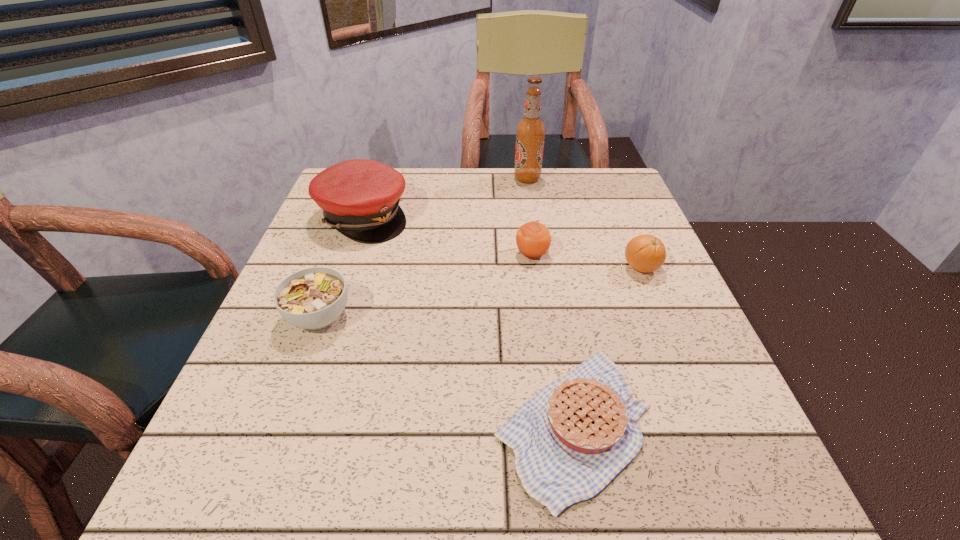
This screenshot has height=540, width=960. Find the location of `soup bowl that is positioned at the left edge`. soup bowl that is positioned at the left edge is located at coordinates (313, 298).

Identify the location of orange that is at the right edge. Image resolution: width=960 pixels, height=540 pixels. (646, 253).

Locate an element on the screen. Image resolution: width=960 pixels, height=540 pixels. pie situated at the right edge is located at coordinates (576, 434).

Where is `object that is positioned at the far left corner`? The height and width of the screenshot is (540, 960). object that is positioned at the far left corner is located at coordinates (360, 198).

Identify the location of object that is at the near right corner. The width and height of the screenshot is (960, 540). (576, 434).

Find the location of a particular element. vacant space at the far edge of the desktop is located at coordinates (557, 204).

I want to click on vacant region at the near edge of the desktop, so click(x=455, y=497).

At what (x,y) coordinates should I click in order to perform the action: click on free spot at the left edge of the desktop. Please return your answer as a coordinate pair (x, y). The height and width of the screenshot is (540, 960). Looking at the image, I should click on (354, 302).

In the image, there is a desktop. Identify the location of vacant region at the right edge. (607, 278).

This screenshot has width=960, height=540. In order to click on free space at the near right corner of the desktop in this screenshot , I will do `click(739, 488)`.